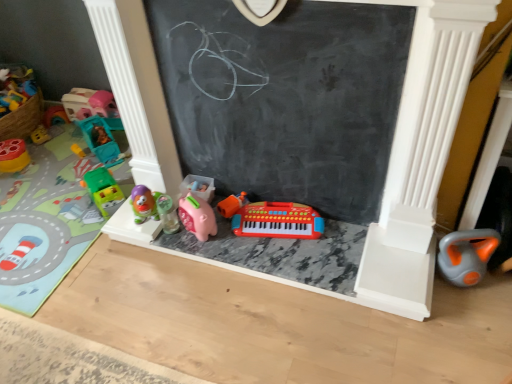
Locate an element on the screen. The height and width of the screenshot is (384, 512). free spot to the left of translucent plastic car at upper left, which is counted as the 3th toy, starting from the left is located at coordinates (52, 135).